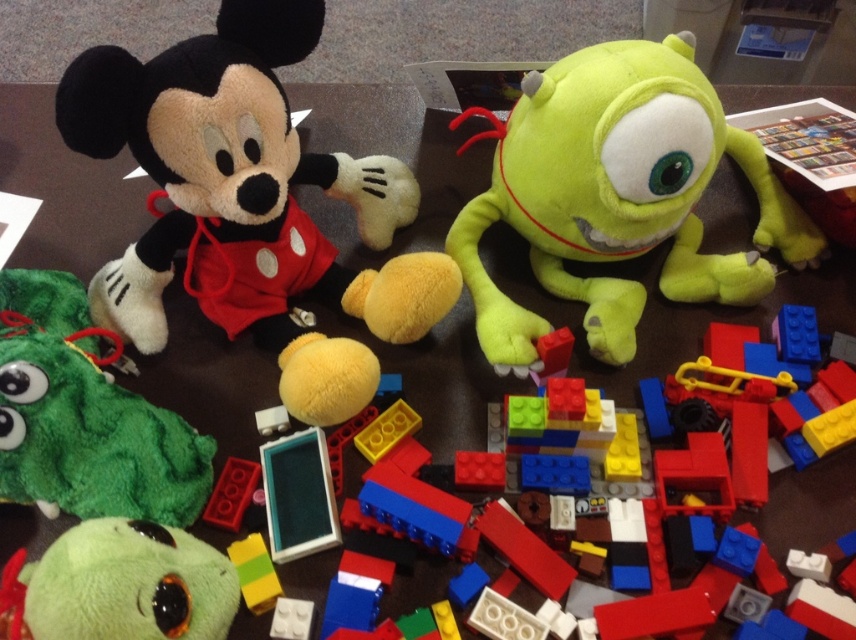
You are organizing a play area and need to place a new toy on the table. The table has a dark surface with the soft plush mickey mouse at upper left already placed. Where should you position the new toy to ensure it is not directly overlapping the Mickey Mouse?

The soft plush mickey mouse at upper left is located at point [248,204]. To avoid overlapping, position the new toy away from these coordinates.

You are a child trying to place a new toy between the soft plush mickey mouse at upper left and the green fuzzy plush at lower left. The new toy is 6 inches wide. Can the new toy fit in the space between them?

The distance between the soft plush mickey mouse at upper left and the green fuzzy plush at lower left is 7.26 inches. Since the new toy is 6 inches wide, it can fit in the space between them as the available space is wider than the toy.

You are organizing the toys on the table and need to place the soft plush mickey mouse at upper left and the green fuzzy plush at lower left. Which one is positioned higher up on the table?

The soft plush mickey mouse at upper left is positioned higher up on the table than the green fuzzy plush at lower left.